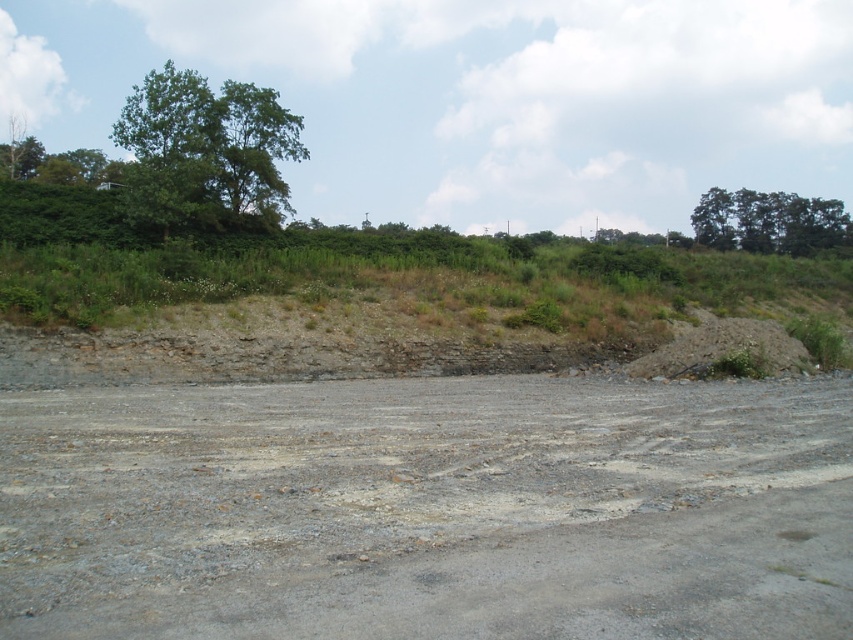
Question: Can you confirm if gray gravel dirt track at center is smaller than green leafy trees at upper right?

Choices:
 (A) yes
 (B) no

Answer: (A)

Question: Observing the image, what is the correct spatial positioning of green leafy tree at upper left in reference to green leafy trees at upper right?

Choices:
 (A) above
 (B) below

Answer: (A)

Question: Is gray gravel dirt track at center thinner than green leafy trees at upper right?

Choices:
 (A) yes
 (B) no

Answer: (A)

Question: Estimate the real-world distances between objects in this image. Which object is closer to the green leafy tree at upper left?

Choices:
 (A) gray gravel dirt track at center
 (B) brown dirt hillside at upper center

Answer: (B)

Question: Estimate the real-world distances between objects in this image. Which object is closer to the gray gravel dirt track at center?

Choices:
 (A) green leafy trees at upper right
 (B) brown dirt hillside at upper center

Answer: (B)

Question: Which of the following is the farthest from the observer?

Choices:
 (A) gray gravel dirt track at center
 (B) brown dirt hillside at upper center

Answer: (B)